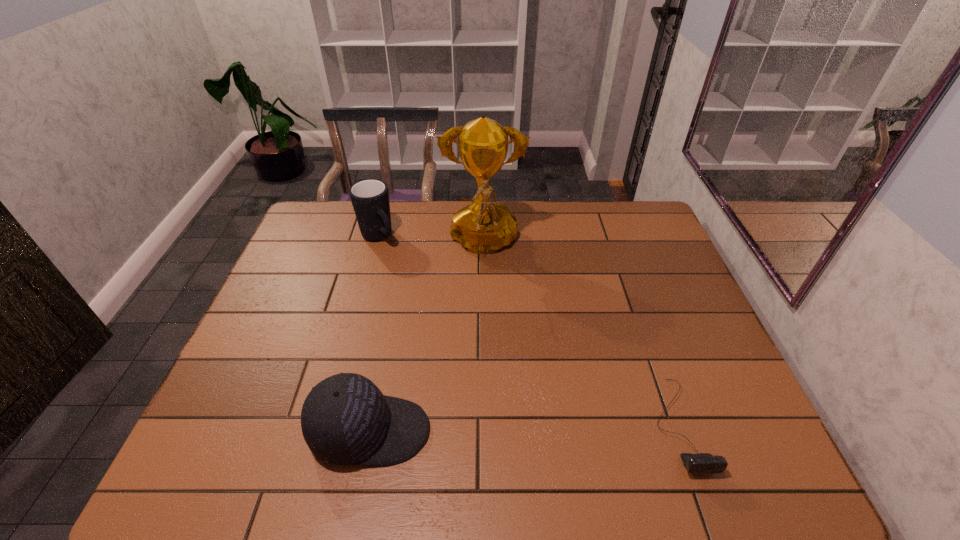
The width and height of the screenshot is (960, 540). In order to click on the second shortest object in this screenshot , I will do pos(346,420).

Locate an element on the screen. Image resolution: width=960 pixels, height=540 pixels. the shortest object is located at coordinates (704, 463).

I want to click on webcam, so click(x=704, y=463).

Where is `award`? Image resolution: width=960 pixels, height=540 pixels. award is located at coordinates pyautogui.click(x=482, y=227).

Image resolution: width=960 pixels, height=540 pixels. In order to click on mug in this screenshot , I will do `click(370, 198)`.

I want to click on blank space located at the front of the second shortest object where the brim is located, so [x=577, y=431].

This screenshot has width=960, height=540. I want to click on free space located 0.310m on the front side of the award, so click(483, 352).

The width and height of the screenshot is (960, 540). I want to click on free space located 0.280m on the front side of the award, so click(483, 343).

Where is `vacant space situated on the front side of the award`? This screenshot has width=960, height=540. vacant space situated on the front side of the award is located at coordinates (483, 326).

You are a GUI agent. You are given a task and a screenshot of the screen. Output one action in this format:
    pyautogui.click(x=<x>, y=<y>)
    Task: Click on the free space located on the side of the third shortest object with the handle
    
    Given the screenshot: What is the action you would take?
    pyautogui.click(x=402, y=265)